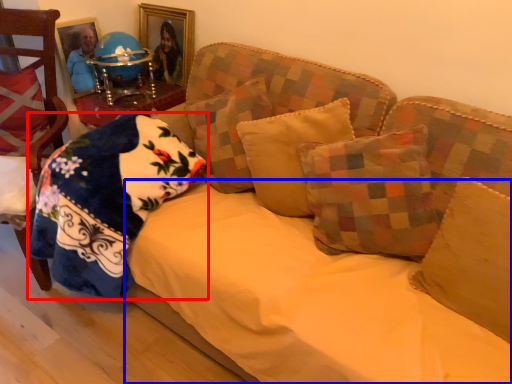
Question: Among these objects, which one is farthest to the camera, pillow (highlighted by a red box) or sheet (highlighted by a blue box)?

Choices:
 (A) pillow
 (B) sheet

Answer: (A)